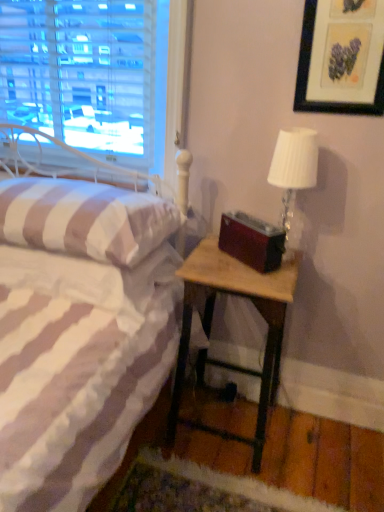
Where is `matte black picture frame at upper right`? matte black picture frame at upper right is located at coordinates (341, 58).

The height and width of the screenshot is (512, 384). Find the location of `white textured lampshade at upper right`. white textured lampshade at upper right is located at coordinates (293, 170).

What do you see at coordinates (211, 324) in the screenshot? Image resolution: width=384 pixels, height=512 pixels. I see `wooden nightstand at lower right` at bounding box center [211, 324].

Locate an element on the screen. white striped fabric pillow at left is located at coordinates (84, 219).

Is wooden nightstand at lower right surrounded by matte black picture frame at upper right?

No, matte black picture frame at upper right does not contain wooden nightstand at lower right.

Who is smaller, matte black picture frame at upper right or wooden nightstand at lower right?

Smaller between the two is matte black picture frame at upper right.

Is matte black picture frame at upper right taller or shorter than wooden nightstand at lower right?

Clearly, matte black picture frame at upper right is shorter compared to wooden nightstand at lower right.

From a real-world perspective, is matte black picture frame at upper right beneath wooden nightstand at lower right?

No, from a real-world perspective, matte black picture frame at upper right is not beneath wooden nightstand at lower right.

From a real-world perspective, does white textured lampshade at upper right sit lower than wooden nightstand at lower right?

No, from a real-world perspective, white textured lampshade at upper right is not beneath wooden nightstand at lower right.

Does white textured lampshade at upper right appear on the right side of wooden nightstand at lower right?

Correct, you'll find white textured lampshade at upper right to the right of wooden nightstand at lower right.

Could you tell me if white textured lampshade at upper right is facing wooden nightstand at lower right?

No, white textured lampshade at upper right is not oriented towards wooden nightstand at lower right.

Does white textured lampshade at upper right have a lesser height compared to wooden nightstand at lower right?

Indeed, white textured lampshade at upper right has a lesser height compared to wooden nightstand at lower right.

Is wooden nightstand at lower right taller than white textured lampshade at upper right?

Yes, wooden nightstand at lower right is taller than white textured lampshade at upper right.

Which object is thinner, wooden nightstand at lower right or white textured lampshade at upper right?

white textured lampshade at upper right.

From the picture: From a real-world perspective, between wooden nightstand at lower right and white textured lampshade at upper right, who is vertically higher?

white textured lampshade at upper right is physically above.

Can we say wooden nightstand at lower right lies outside white textured lampshade at upper right?

Yes, wooden nightstand at lower right is not within white textured lampshade at upper right.

Does white textured lampshade at upper right have a lesser height compared to white striped fabric pillow at left?

Answer: Incorrect, the height of white textured lampshade at upper right does not fall short of that of white striped fabric pillow at left.

Find the location of a particular element. table lamp that is behind the white striped fabric pillow at left is located at coordinates (293, 170).

From the image's perspective, is white textured lampshade at upper right under white striped fabric pillow at left?

Actually, white textured lampshade at upper right appears above white striped fabric pillow at left in the image.

Which object is further away from the camera, white striped fabric pillow at left or wooden nightstand at lower right?

wooden nightstand at lower right.

Could wooden nightstand at lower right be considered to be inside white striped fabric pillow at left?

Actually, wooden nightstand at lower right is outside white striped fabric pillow at left.

Visually, is white striped fabric pillow at left positioned to the left or to the right of wooden nightstand at lower right?

In the image, white striped fabric pillow at left appears on the left side of wooden nightstand at lower right.

Are white striped fabric pillow at left and wooden nightstand at lower right far apart?

No.

In terms of width, does matte black picture frame at upper right look wider or thinner when compared to white textured lampshade at upper right?

matte black picture frame at upper right is thinner than white textured lampshade at upper right.

Does matte black picture frame at upper right have a greater height compared to white textured lampshade at upper right?

In fact, matte black picture frame at upper right may be shorter than white textured lampshade at upper right.

Locate an element on the screen. table lamp behind the matte black picture frame at upper right is located at coordinates (293, 170).

From the image's perspective, which is above, matte black picture frame at upper right or white textured lampshade at upper right?

matte black picture frame at upper right appears higher in the image.

Which of these two, white textured lampshade at upper right or matte black picture frame at upper right, is wider?

white textured lampshade at upper right is wider.

Who is taller, white textured lampshade at upper right or matte black picture frame at upper right?

With more height is white textured lampshade at upper right.

Measure the distance between white textured lampshade at upper right and matte black picture frame at upper right.

white textured lampshade at upper right is 9.28 inches from matte black picture frame at upper right.

Is white textured lampshade at upper right oriented away from matte black picture frame at upper right?

No.

Locate an element on the screen. This screenshot has width=384, height=512. picture frame on the right of wooden nightstand at lower right is located at coordinates (341, 58).

At what (x,y) coordinates should I click in order to perform the action: click on nightstand on the left of white textured lampshade at upper right. Please return your answer as a coordinate pair (x, y). This screenshot has width=384, height=512. Looking at the image, I should click on (211, 324).

Considering their positions, is matte black picture frame at upper right positioned further to wooden nightstand at lower right than white striped fabric pillow at left?

matte black picture frame at upper right.

Looking at the image, which one is located further to white striped fabric pillow at left, matte black picture frame at upper right or wooden nightstand at lower right?

matte black picture frame at upper right is positioned further to the anchor white striped fabric pillow at left.

When comparing their distances from white textured lampshade at upper right, does wooden nightstand at lower right or matte black picture frame at upper right seem further?

wooden nightstand at lower right.

When comparing their distances from matte black picture frame at upper right, does white textured lampshade at upper right or wooden nightstand at lower right seem closer?

white textured lampshade at upper right.

Considering their positions, is white striped fabric pillow at left positioned further to white textured lampshade at upper right than matte black picture frame at upper right?

Among the two, white striped fabric pillow at left is located further to white textured lampshade at upper right.

Which object lies further to the anchor point matte black picture frame at upper right, white striped fabric pillow at left or white textured lampshade at upper right?

Based on the image, white striped fabric pillow at left appears to be further to matte black picture frame at upper right.

Considering their positions, is white striped fabric pillow at left positioned closer to wooden nightstand at lower right than white textured lampshade at upper right?

The object closer to wooden nightstand at lower right is white textured lampshade at upper right.

Estimate the real-world distances between objects in this image. Which object is further from white striped fabric pillow at left, wooden nightstand at lower right or matte black picture frame at upper right?

Based on the image, matte black picture frame at upper right appears to be further to white striped fabric pillow at left.

Find the location of a particular element. The image size is (384, 512). nightstand situated between white striped fabric pillow at left and white textured lampshade at upper right from left to right is located at coordinates (211, 324).

You are a GUI agent. You are given a task and a screenshot of the screen. Output one action in this format:
    pyautogui.click(x=<x>, y=<y>)
    Task: Click on the table lamp located between white striped fabric pillow at left and matte black picture frame at upper right in the left-right direction
    Image resolution: width=384 pixels, height=512 pixels.
    Given the screenshot: What is the action you would take?
    pyautogui.click(x=293, y=170)

Where is `table lamp between matte black picture frame at upper right and wooden nightstand at lower right from top to bottom`? table lamp between matte black picture frame at upper right and wooden nightstand at lower right from top to bottom is located at coordinates (293, 170).

Identify the location of pillow between matte black picture frame at upper right and wooden nightstand at lower right in the vertical direction. The image size is (384, 512). (84, 219).